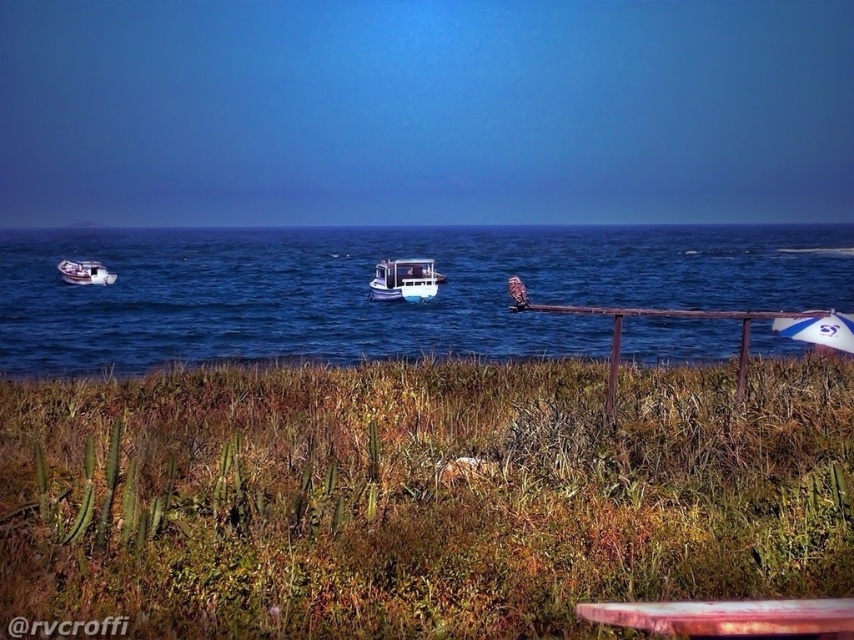
You are standing at the edge of the shore in the coastal scene. You want to locate the blue water at center. Based on your position, in which direction should you look to find it?

Answer: The blue water at center is located at point (382,301) in 2D coordinates, which is slightly to the right and below the center of the image. Since you are at the shore edge, looking towards the center would mean facing towards the water, so you should look directly ahead or slightly to the right to find the blue water at center.

You are planning to set up a small picnic and need to place a blanket on the ground near the rusty metal picnic table at lower right. Given the coordinates provided, can you determine if there is enough space to place the blanket next to the table without being too close to the water?

The rusty metal picnic table at lower right is located at point (730, 618), which is close to the lower right corner of the scene. Since the foreground has a grassy area with cacti and vegetation, there should be sufficient space to place the blanket next to the table without being too close to the water.

You are planning a picnic and want to set up your blanket under the white glossy umbrella at right for shade. However, there is a rusty metal picnic table at lower right nearby. Based on the scene description, can you place your blanket directly under the umbrella without it being obstructed by the table?

The rusty metal picnic table at lower right is located below the white glossy umbrella at right, so placing the blanket directly under the umbrella would be obstructed by the table.